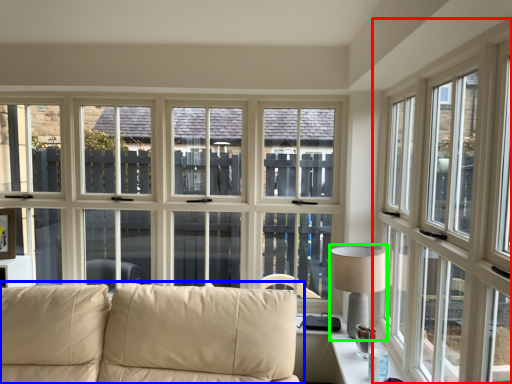
Question: Which object is positioned farthest from window (highlighted by a red box)? Select from studio couch (highlighted by a blue box) and table lamp (highlighted by a green box).

Choices:
 (A) studio couch
 (B) table lamp

Answer: (A)